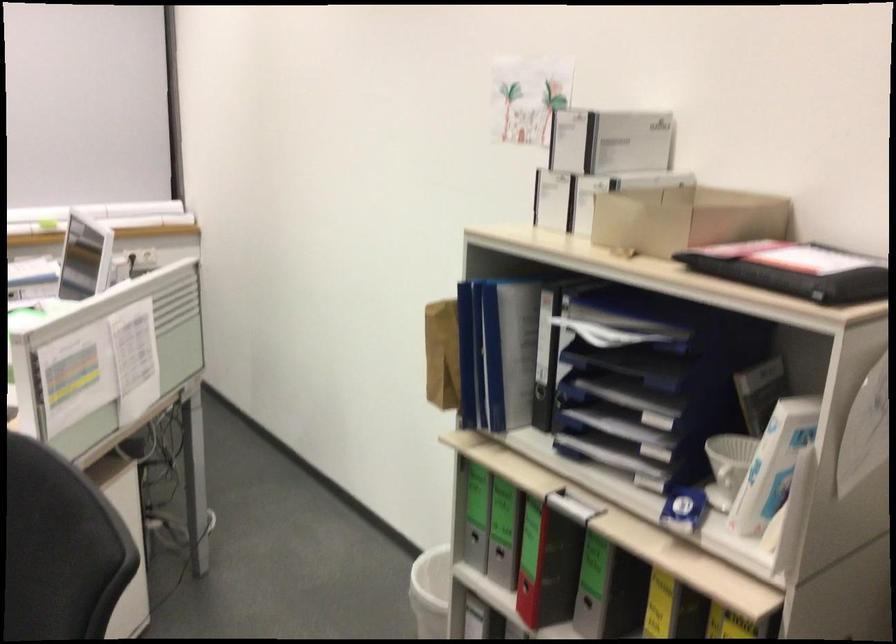
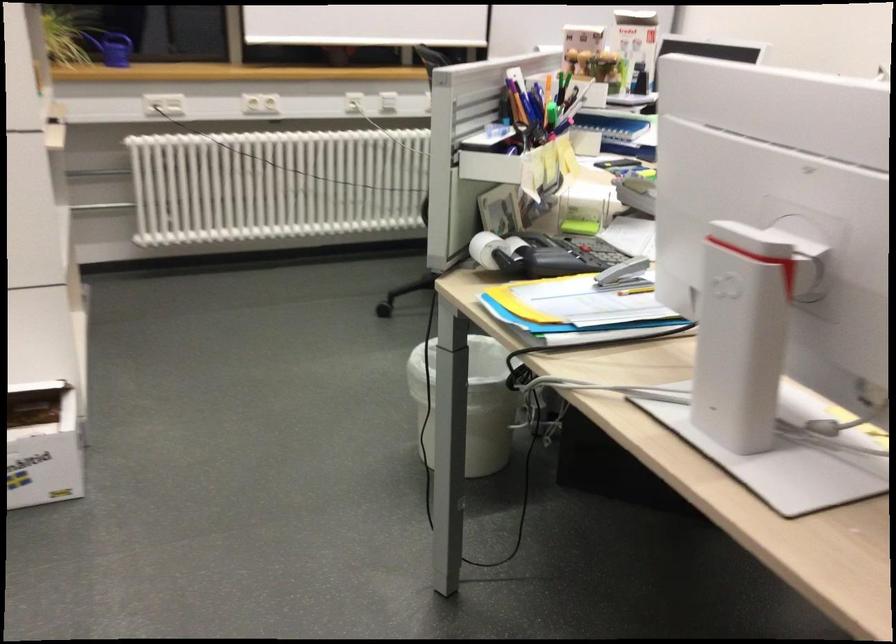
Question: In a continuous first-person perspective shot, in which direction is the camera moving?

Choices:
 (A) Left
 (B) Right
 (C) Forward
 (D) Backward

Answer: (A)